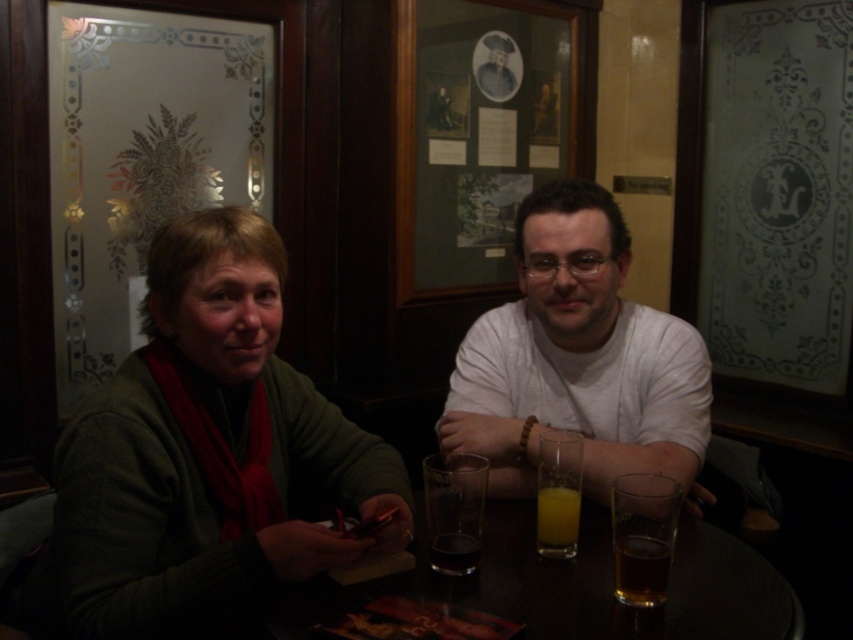
You are a photographer standing behind the two people at the table. You want to take a photo of the green sweater at left and the translucent glass at table center. Which object will appear wider in the photo?

The green sweater at left will appear wider in the photo because its width is larger than that of the translucent glass at table center.

You are standing in the pub and want to find the green sweater at left. What are the coordinates where you should look?

The green sweater at left is located at coordinates point [206,449].

You are a delivery robot with a 50 cm wide package. You need to place the package between the green sweater at left and the translucent glass at table center. Is there enough space?

The distance between the green sweater at left and the translucent glass at table center is 54.19 centimeters. Since the package is 50 cm wide, there is enough space to place it between them.